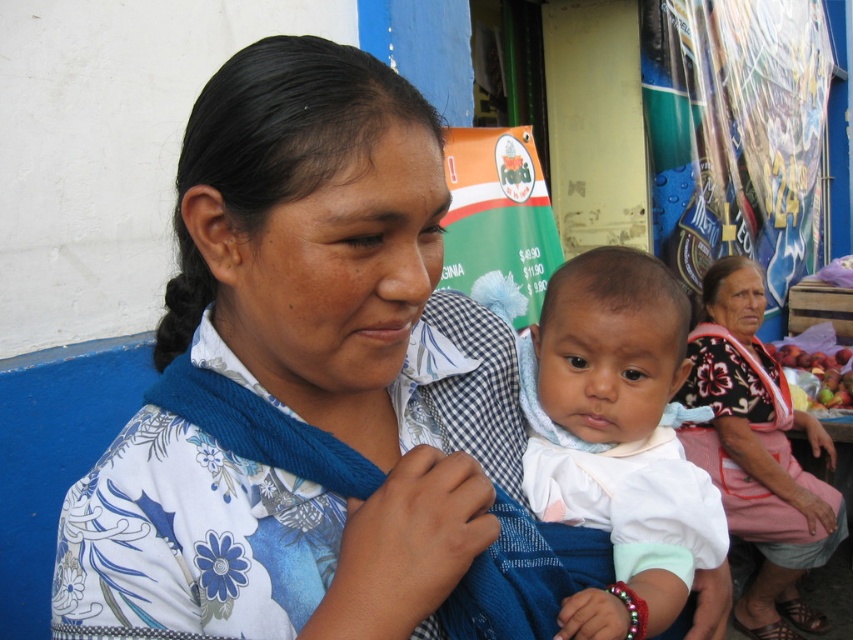
Question: Does white soft cloth at center have a lesser width compared to floral fabric dress at lower right?

Choices:
 (A) no
 (B) yes

Answer: (B)

Question: Is white soft cloth at center positioned behind floral fabric dress at lower right?

Choices:
 (A) no
 (B) yes

Answer: (A)

Question: Does white soft cloth at center come behind floral fabric dress at lower right?

Choices:
 (A) yes
 (B) no

Answer: (B)

Question: Which point appears farthest from the camera in this image?

Choices:
 (A) (161, 460)
 (B) (788, 588)
 (C) (633, 588)

Answer: (B)

Question: Which object is farther from the camera taking this photo?

Choices:
 (A) floral fabric dress at lower right
 (B) blue floral shirt at center

Answer: (A)

Question: Which object is closer to the camera taking this photo?

Choices:
 (A) white soft cloth at center
 (B) floral fabric dress at lower right
 (C) blue floral shirt at center

Answer: (C)